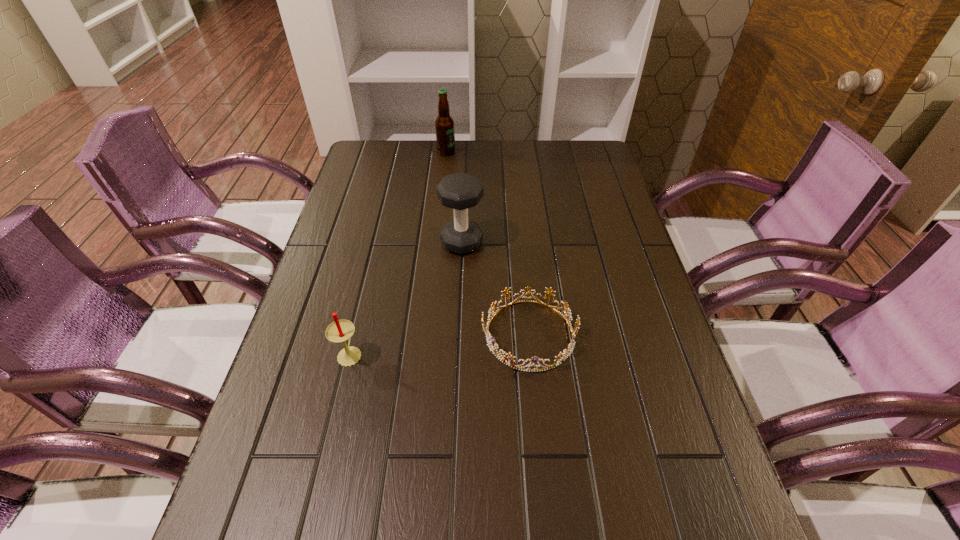
Locate an element on the screen. Image resolution: width=960 pixels, height=540 pixels. free space located 0.060m on the front-facing side of the shortest object is located at coordinates pos(455,334).

Where is `object that is at the far edge`? The height and width of the screenshot is (540, 960). object that is at the far edge is located at coordinates (445, 135).

Identify the location of object located at the left edge. (339, 331).

The height and width of the screenshot is (540, 960). I want to click on free space at the far edge of the desktop, so coord(468,150).

At what (x,y) coordinates should I click in order to perform the action: click on free space at the left edge of the desktop. Please return your answer as a coordinate pair (x, y). Looking at the image, I should click on (366, 275).

Find the location of a particular element. The height and width of the screenshot is (540, 960). vacant region at the right edge of the desktop is located at coordinates (614, 319).

Locate an element on the screen. The width and height of the screenshot is (960, 540). vacant space at the far left corner of the desktop is located at coordinates point(395,164).

Locate an element on the screen. Image resolution: width=960 pixels, height=540 pixels. free point at the far right corner is located at coordinates (589, 148).

Locate an element on the screen. This screenshot has width=960, height=540. free space between the third tallest object and the beer bottle is located at coordinates (398, 253).

Image resolution: width=960 pixels, height=540 pixels. I want to click on vacant region between the farthest object and the shortest object, so click(x=488, y=243).